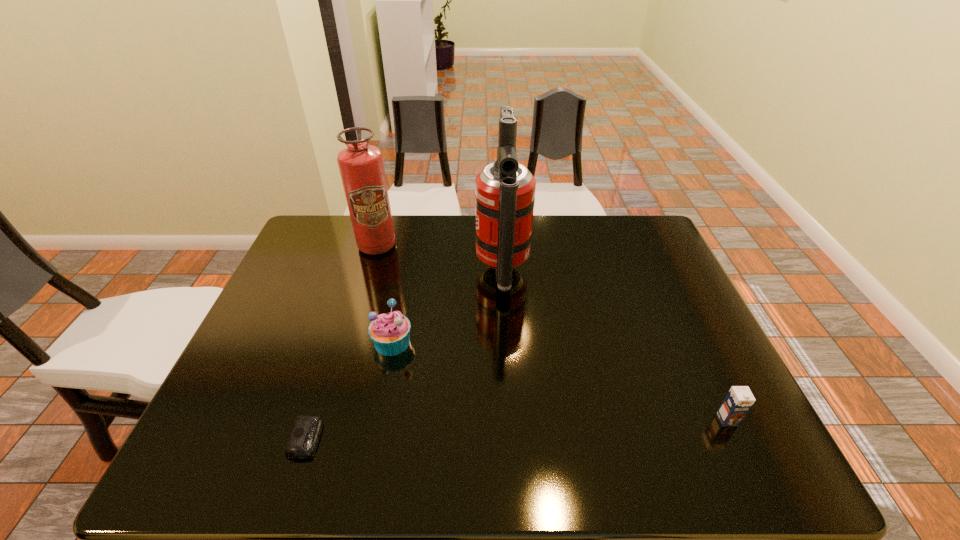
Identify the location of vacant area located on the label side of the fourth shortest object. The width and height of the screenshot is (960, 540). (369, 275).

The image size is (960, 540). What are the coordinates of `free region located on the right of the third nearest object` in the screenshot? It's located at (514, 342).

What are the coordinates of `vacant space located 0.090m on the display of the alarm clock` in the screenshot? It's located at (364, 438).

Locate an element on the screen. Image resolution: width=960 pixels, height=540 pixels. object present at the near edge is located at coordinates (302, 443).

Identify the location of object that is at the right edge. This screenshot has width=960, height=540. (738, 401).

Identify the location of blank area at the far edge. (552, 224).

This screenshot has height=540, width=960. I want to click on free space at the near edge, so click(371, 451).

The height and width of the screenshot is (540, 960). Find the location of `vacant space at the left edge of the desktop`. vacant space at the left edge of the desktop is located at coordinates (331, 260).

You are a GUI agent. You are given a task and a screenshot of the screen. Output one action in this format:
    pyautogui.click(x=<x>, y=<y>)
    Task: Click on the vacant area at the right edge of the desktop
    This screenshot has width=960, height=540.
    Given the screenshot: What is the action you would take?
    pyautogui.click(x=627, y=284)

Where is `vacant space at the far right corner`? The height and width of the screenshot is (540, 960). vacant space at the far right corner is located at coordinates (622, 239).